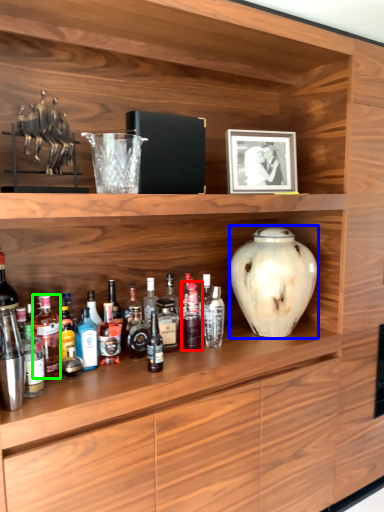
Question: Which is nearer to the bottle (highlighted by a red box)? vase (highlighted by a blue box) or bottle (highlighted by a green box).

Choices:
 (A) vase
 (B) bottle

Answer: (A)